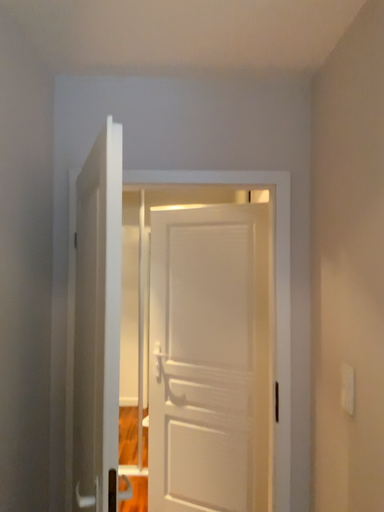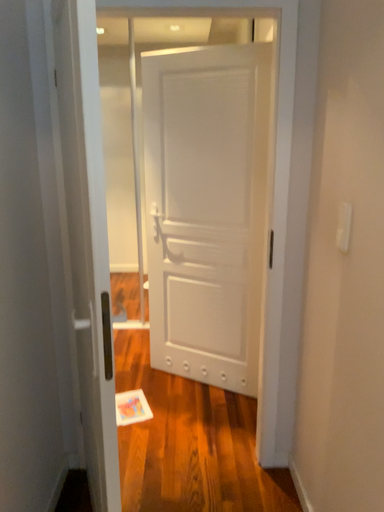
Question: How did the camera likely rotate when shooting the video?

Choices:
 (A) rotated upward
 (B) rotated downward

Answer: (B)